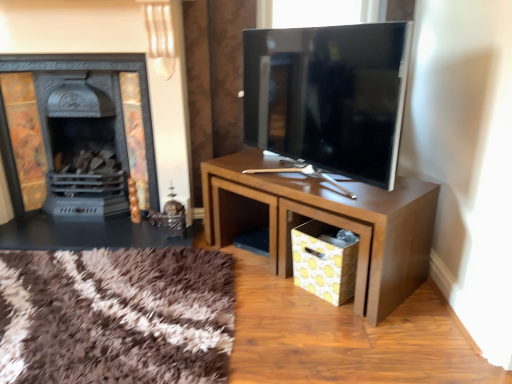
Question: Considering the positions of brown wood table at center and black matte fireplace at left in the image, is brown wood table at center taller or shorter than black matte fireplace at left?

Choices:
 (A) short
 (B) tall

Answer: (A)

Question: In the image, is brown wood table at center positioned in front of or behind black matte fireplace at left?

Choices:
 (A) behind
 (B) front

Answer: (B)

Question: Which object is the closest to the yellow paper drawer at lower right?

Choices:
 (A) black matte fireplace at left
 (B) brown wood table at center
 (C) matte black tv at center

Answer: (B)

Question: Estimate the real-world distances between objects in this image. Which object is farther from the brown wood table at center?

Choices:
 (A) yellow paper drawer at lower right
 (B) matte black tv at center
 (C) black matte fireplace at left

Answer: (C)